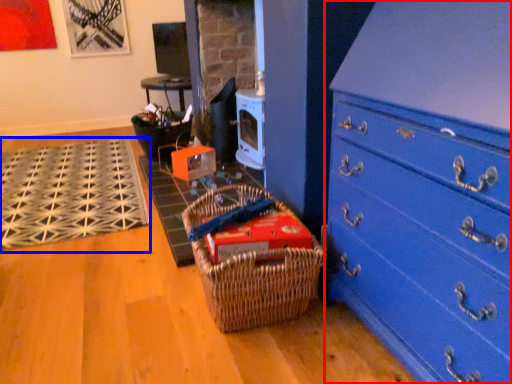
Question: Which object appears closest to the camera in this image, chest of drawers (highlighted by a red box) or doormat (highlighted by a blue box)?

Choices:
 (A) chest of drawers
 (B) doormat

Answer: (A)